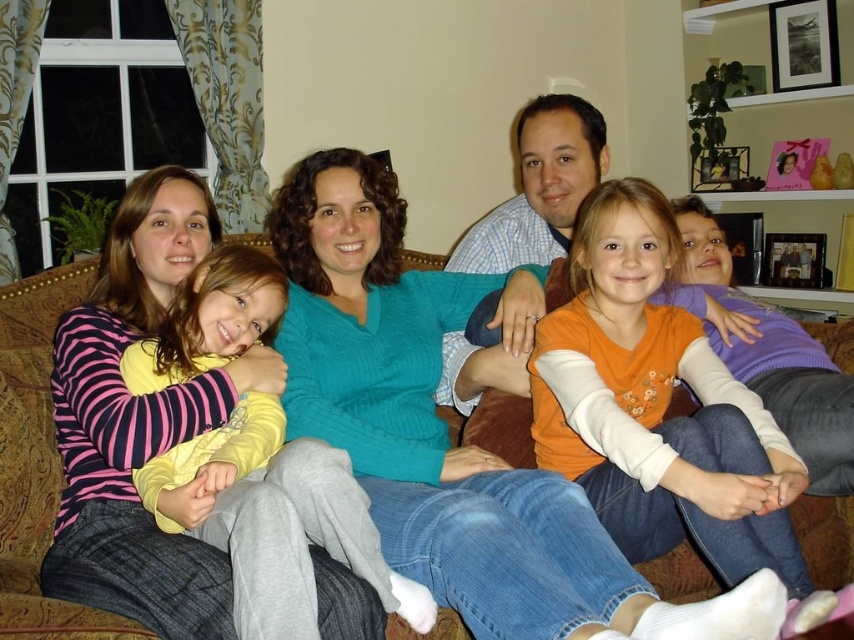
Can you confirm if orange cotton shirt at center is wider than striped fleece sweater at left?

Correct, the width of orange cotton shirt at center exceeds that of striped fleece sweater at left.

The width and height of the screenshot is (854, 640). What do you see at coordinates (661, 410) in the screenshot? I see `orange cotton shirt at center` at bounding box center [661, 410].

This screenshot has height=640, width=854. What are the coordinates of `orange cotton shirt at center` in the screenshot? It's located at (661, 410).

Locate an element on the screen. orange cotton shirt at center is located at coordinates (661, 410).

Find the location of a particular element. yellow long-sleeve shirt at center is located at coordinates (276, 522).

Is yellow long-sleeve shirt at center below striped fleece sweater at left?

Indeed, yellow long-sleeve shirt at center is positioned under striped fleece sweater at left.

The image size is (854, 640). What do you see at coordinates (276, 522) in the screenshot? I see `yellow long-sleeve shirt at center` at bounding box center [276, 522].

The image size is (854, 640). What are the coordinates of `yellow long-sleeve shirt at center` in the screenshot? It's located at pyautogui.click(x=276, y=522).

Does point (597, 456) lie behind point (182, 314)?

Yes, point (597, 456) is behind point (182, 314).

Describe the element at coordinates (661, 410) in the screenshot. This screenshot has height=640, width=854. I see `orange cotton shirt at center` at that location.

Where is `orange cotton shirt at center`? The height and width of the screenshot is (640, 854). orange cotton shirt at center is located at coordinates (661, 410).